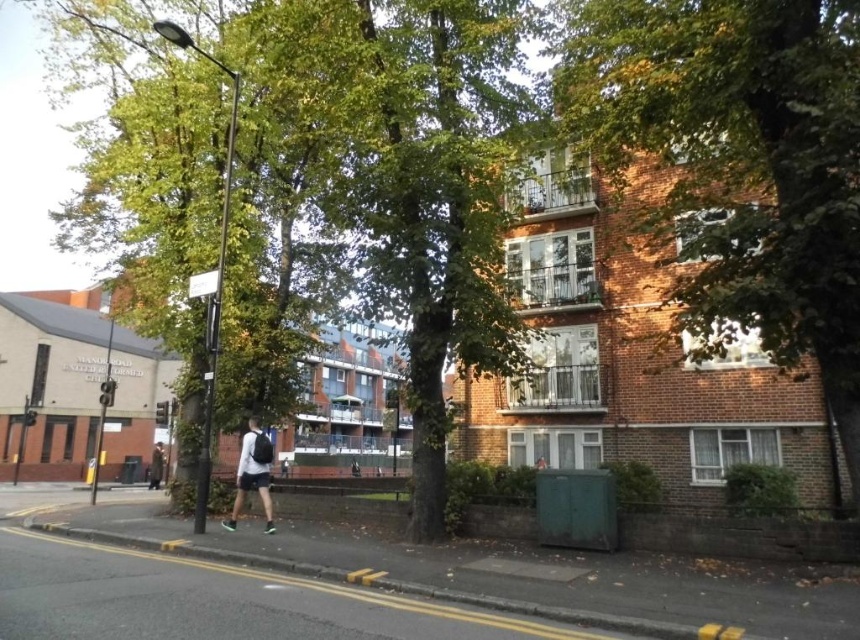
Is white matte shirt at center further to the viewer compared to dark gray backpack at lower left?

That is False.

The width and height of the screenshot is (860, 640). What do you see at coordinates (252, 474) in the screenshot?
I see `white matte shirt at center` at bounding box center [252, 474].

Locate an element on the screen. white matte shirt at center is located at coordinates (252, 474).

Where is `white matte shirt at center`? This screenshot has width=860, height=640. white matte shirt at center is located at coordinates (252, 474).

Can you confirm if green leafy tree at upper center is bigger than white matte shirt at center?

Indeed, green leafy tree at upper center has a larger size compared to white matte shirt at center.

Is point (838, 108) behind point (243, 497)?

No, it is not.

Does point (784, 304) come farther from viewer compared to point (238, 458)?

No, it is in front of (238, 458).

Identify the location of green leafy tree at upper center. (740, 161).

Does green leafy tree at upper center have a lesser width compared to dark gray backpack at lower left?

Correct, green leafy tree at upper center's width is less than dark gray backpack at lower left's.

Between point (822, 308) and point (161, 476), which one is positioned behind?

The point (161, 476) is behind.

The image size is (860, 640). I want to click on green leafy tree at upper center, so click(x=740, y=161).